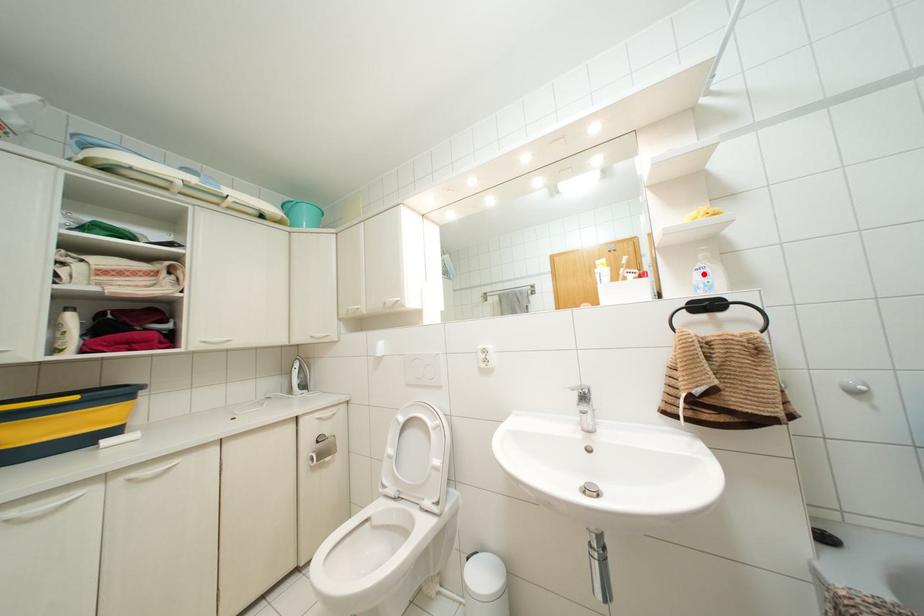
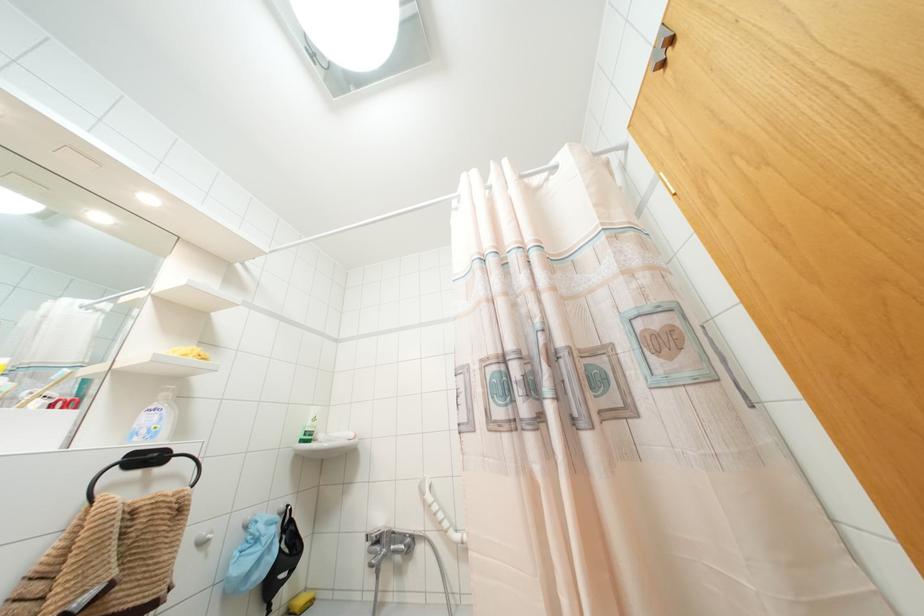
Find the pixel in the second image that matches the highlighted location in the first image.

(154, 418)